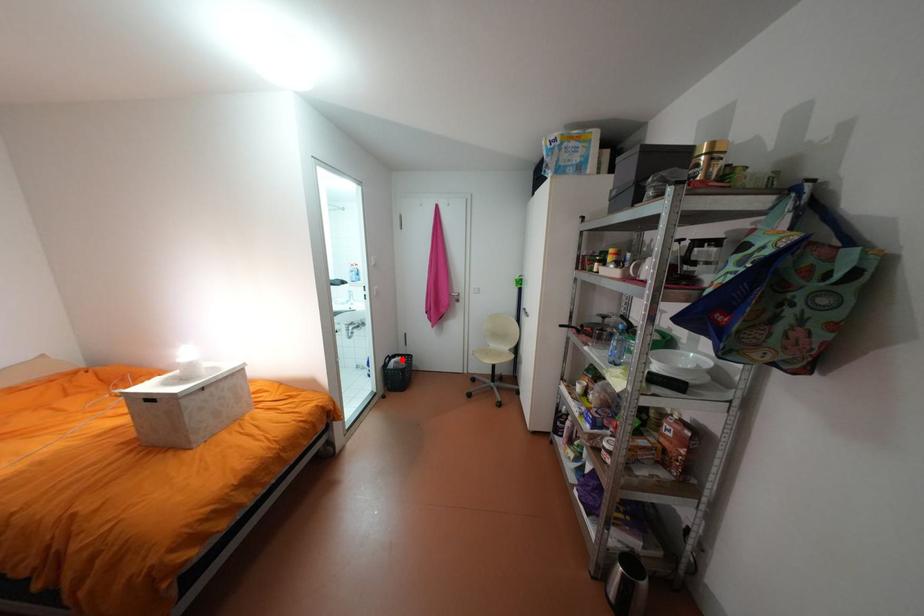
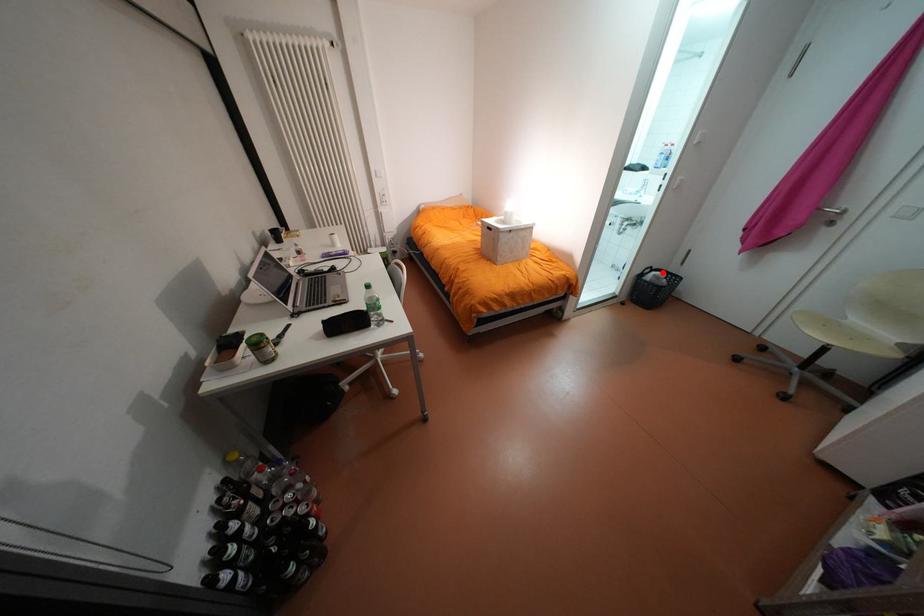
I am providing you with two images of the same scene from different viewpoints. A red point is marked on the first image and another point is marked on the second image. Do the highlighted points in image1 and image2 indicate the same real-world spot?

Yes